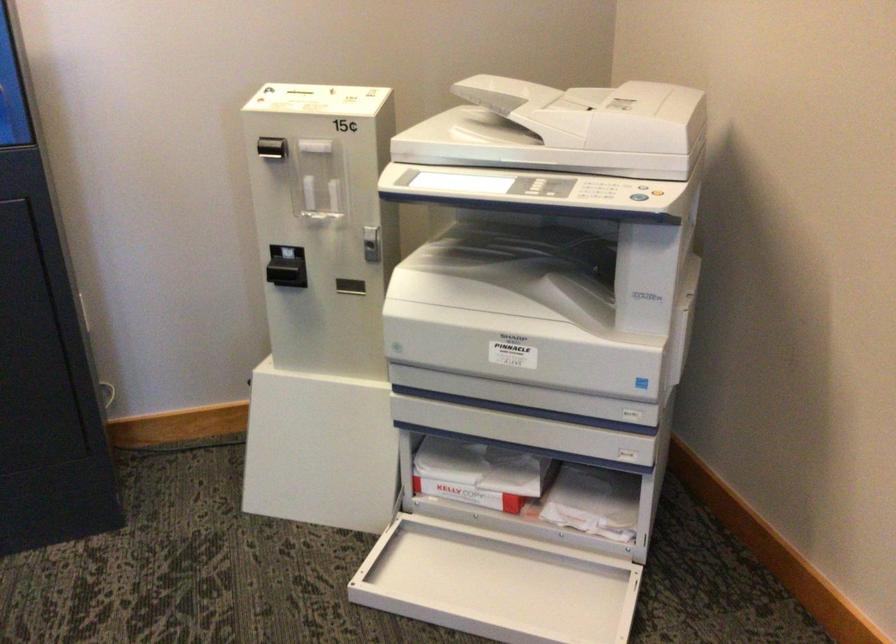
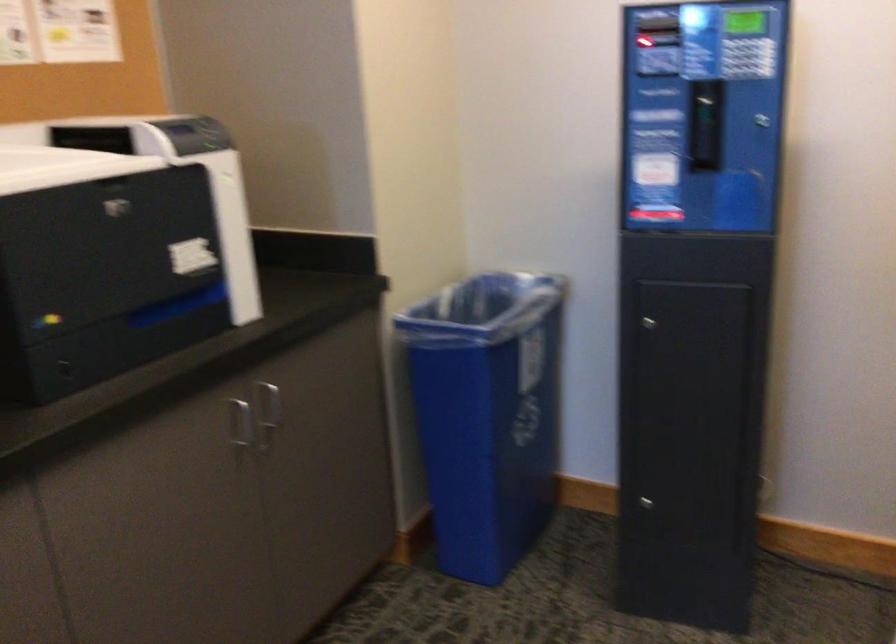
Question: The camera is either moving clockwise (left) or counter-clockwise (right) around the object. The first image is from the beginning of the video and the second image is from the end. Is the camera moving left or right when shooting the video?

Choices:
 (A) Left
 (B) Right

Answer: (B)